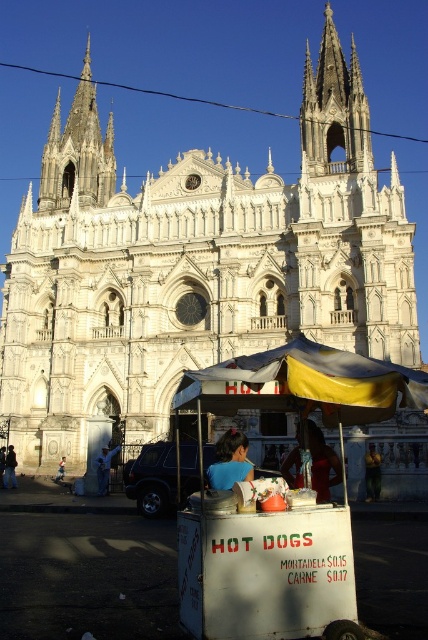
Which is behind, point (422, 404) or point (207, 468)?

The point (207, 468) is more distant.

Identify the location of yellow fabric canopy at lower center. (306, 385).

At what (x,y) coordinates should I click in order to perform the action: click on yellow fabric canopy at lower center. Please return your answer as a coordinate pair (x, y). The height and width of the screenshot is (640, 428). Looking at the image, I should click on (306, 385).

Between point (333, 458) and point (115, 448), which one is positioned behind?

Positioned behind is point (115, 448).

The height and width of the screenshot is (640, 428). What do you see at coordinates (321, 464) in the screenshot?
I see `red fabric umbrella at center` at bounding box center [321, 464].

At what (x,y) coordinates should I click in order to perform the action: click on red fabric umbrella at center. Please return your answer as a coordinate pair (x, y). This screenshot has width=428, height=640. Looking at the image, I should click on (321, 464).

Does point (321, 449) come in front of point (59, 467)?

Yes, point (321, 449) is closer to viewer.

Is point (287, 460) farther from viewer compared to point (62, 474)?

No, it is in front of (62, 474).

Where is `red fabric umbrella at center`? This screenshot has width=428, height=640. red fabric umbrella at center is located at coordinates (321, 464).

Find the location of a particular element. This screenshot has height=640, width=428. red fabric umbrella at center is located at coordinates (321, 464).